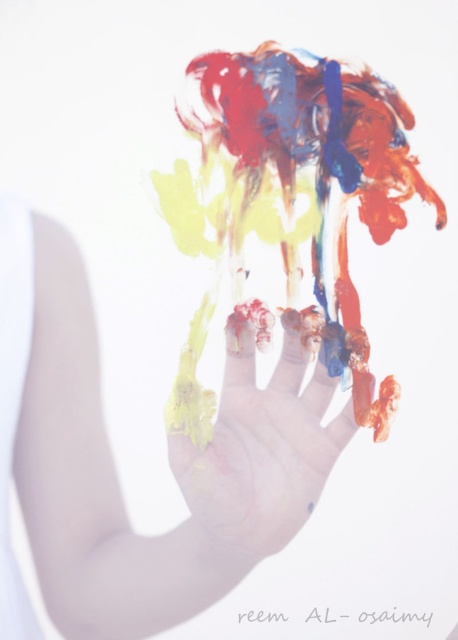
Does painted hand at center have a lesser height compared to painted plastic hand at center?

Incorrect, painted hand at center's height does not fall short of painted plastic hand at center's.

Is painted hand at center wider than painted plastic hand at center?

Correct, the width of painted hand at center exceeds that of painted plastic hand at center.

I want to click on painted hand at center, so click(x=114, y=465).